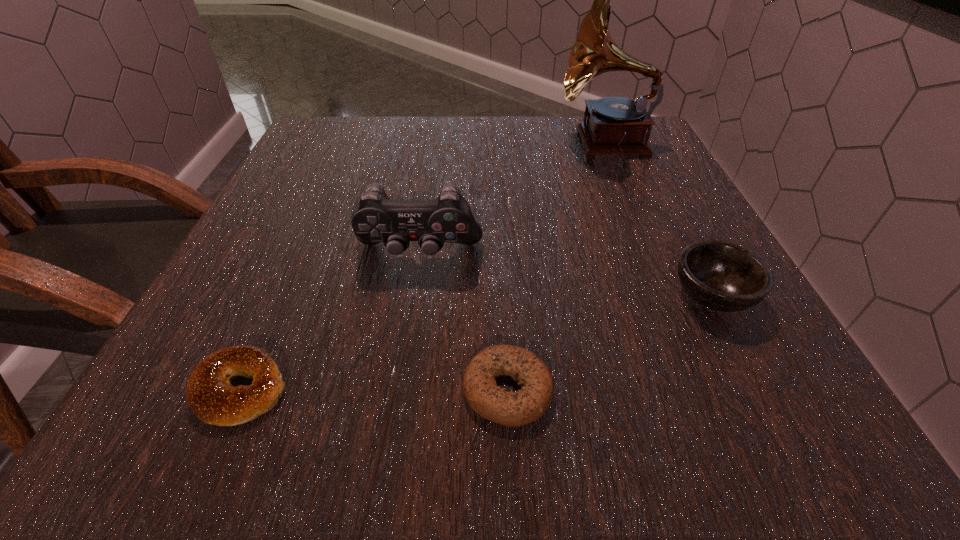
Locate an element on the screen. This screenshot has height=540, width=960. vacant region at the near edge of the desktop is located at coordinates (304, 419).

Image resolution: width=960 pixels, height=540 pixels. I want to click on vacant space at the left edge of the desktop, so click(255, 276).

Locate an element on the screen. The width and height of the screenshot is (960, 540). free space at the right edge of the desktop is located at coordinates (676, 197).

This screenshot has height=540, width=960. What are the coordinates of `free space at the far left corner of the desktop` in the screenshot? It's located at (371, 145).

You are a GUI agent. You are given a task and a screenshot of the screen. Output one action in this format:
    pyautogui.click(x=<x>, y=<y>)
    Task: Click on the free spot between the third tallest object and the control
    The width and height of the screenshot is (960, 540).
    Given the screenshot: What is the action you would take?
    pyautogui.click(x=565, y=275)

The height and width of the screenshot is (540, 960). I want to click on free space that is in between the fourth shortest object and the left bagel, so click(x=330, y=322).

I want to click on vacant region between the leftmost object and the fourth shortest object, so click(x=330, y=322).

Where is `vacant space in between the fourth shortest object and the third shortest object`? This screenshot has height=540, width=960. vacant space in between the fourth shortest object and the third shortest object is located at coordinates (565, 275).

At what (x,y) coordinates should I click in order to perform the action: click on free area in between the right bagel and the tallest object. Please return your answer as a coordinate pair (x, y). The width and height of the screenshot is (960, 540). Looking at the image, I should click on (556, 265).

The image size is (960, 540). I want to click on free spot between the leftmost object and the right bagel, so click(x=374, y=389).